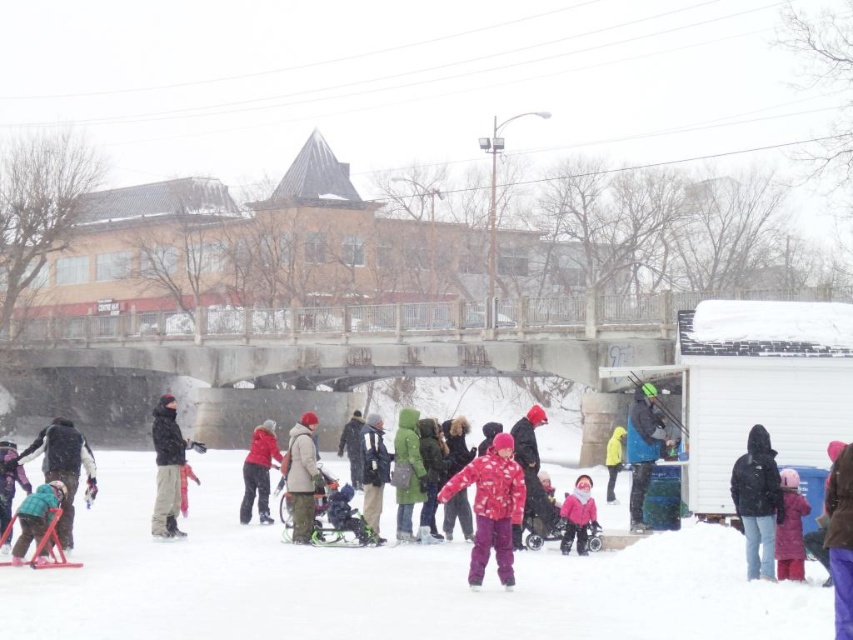
From the picture: You are a photographer at the winter event and want to take a photo of both the green fabric jacket at center and the yellow matte jacket at center. Which jacket should you adjust your camera angle to focus on first if you want to capture them from left to right in the frame?

You should focus on the green fabric jacket at center first since it is positioned to the left of the yellow matte jacket at center, aligning with the left to right order in the frame.

You are organizing a photo shoot and need to place two jackets in the center of the scene. The green fuzzy jacket at center and the yellow matte jacket at center must be positioned side by side. Which jacket should you place on the left to ensure they fit within a 1.5 meter wide space?

The green fuzzy jacket at center has a smaller width than the yellow matte jacket at center. To fit them within the 1.5 meter space, place the narrower green fuzzy jacket at center on the left and the wider yellow matte jacket at center on the right.

Based on the photo, you are a photographer trying to capture a photo of both the green fuzzy jacket at center and the yellow matte jacket at center. Since you want both jackets to be clearly visible in the photo, which jacket should you focus on first to ensure both are in focus?

You should focus on the green fuzzy jacket at center first because it is closer to the viewer than the yellow matte jacket at center, so by focusing on the closer one, both will be in focus.